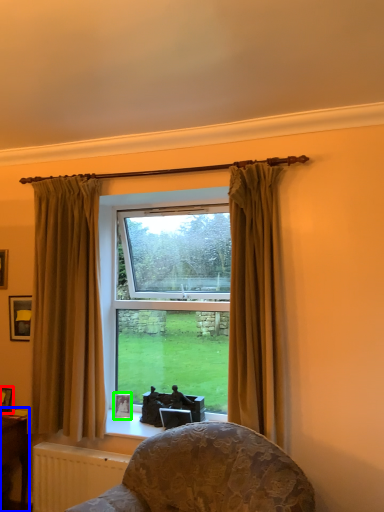
Question: Which object is the closest to the picture frame (highlighted by a red box)? Choose among these: table (highlighted by a blue box) or picture frame (highlighted by a green box).

Choices:
 (A) table
 (B) picture frame

Answer: (A)